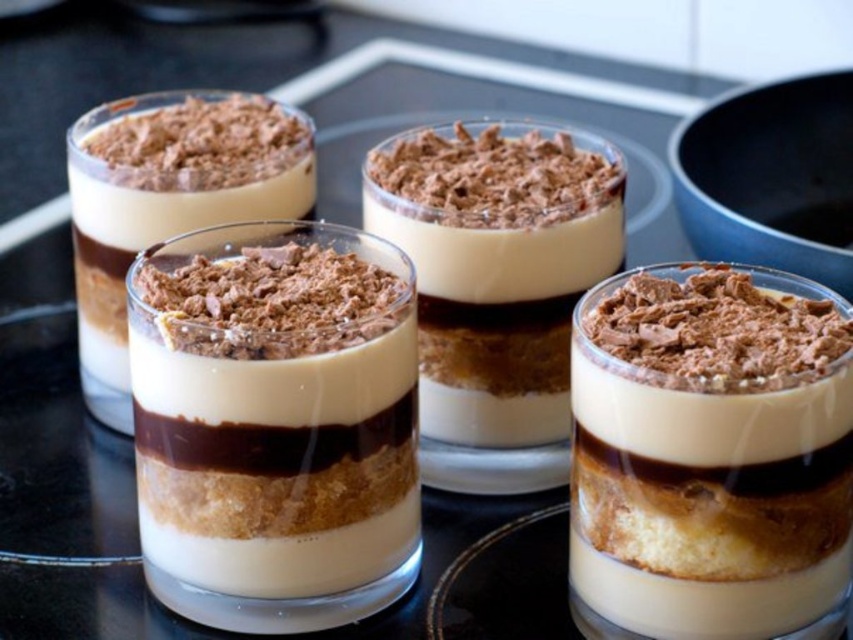
Is matte chocolate dessert at center bigger than smooth chocolate mousse at center?

Incorrect, matte chocolate dessert at center is not larger than smooth chocolate mousse at center.

Is matte chocolate dessert at center thinner than smooth chocolate mousse at center?

Indeed, matte chocolate dessert at center has a lesser width compared to smooth chocolate mousse at center.

What are the coordinates of `matte chocolate dessert at center` in the screenshot? It's located at (497, 266).

The width and height of the screenshot is (853, 640). Identify the location of matte chocolate dessert at center. (497, 266).

Who is positioned more to the right, white creamy pudding at center or matte chocolate pudding at center?

From the viewer's perspective, matte chocolate pudding at center appears more on the right side.

Which of these two, white creamy pudding at center or matte chocolate pudding at center, stands shorter?

matte chocolate pudding at center

This screenshot has height=640, width=853. I want to click on white creamy pudding at center, so click(x=276, y=424).

Between matte chocolate pudding at center and smooth chocolate mousse at center, which one is positioned lower?

Positioned lower is matte chocolate pudding at center.

Is point (653, 481) positioned behind point (254, 218)?

No, it is not.

Find the location of a particular element. The image size is (853, 640). matte chocolate pudding at center is located at coordinates (711, 451).